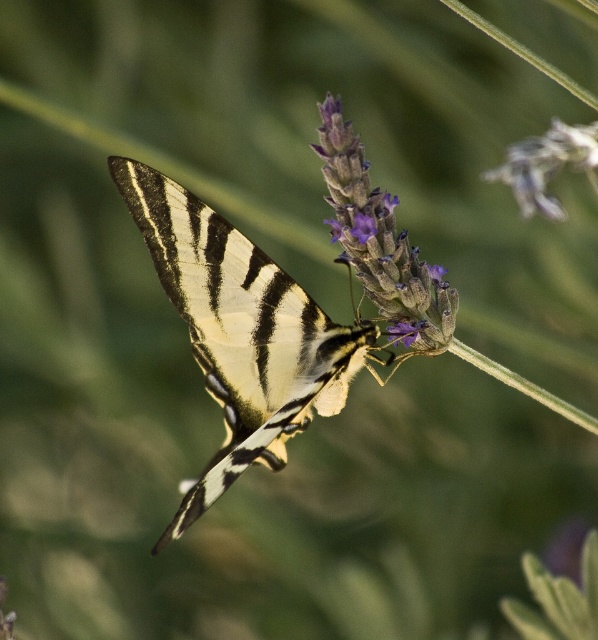
You are an entomologist studying the positioning of insects in natural settings. In the image provided, where is the shiny gold butterfly at center located in terms of its 2D coordinates?

The shiny gold butterfly at center is located at the 2D coordinates of point (x=240, y=332).

You are a photographer trying to capture the shiny gold butterfly at center and the purple fuzzy lavender at center. Which object will appear larger in your photo?

The shiny gold butterfly at center will appear larger in the photo because it is closer to the viewer than the purple fuzzy lavender at center.

You are holding a net to catch the shiny gold butterfly at center. The net can reach up to 1.5 meters. Can you catch it?

The shiny gold butterfly at center is 1.71 meters away from the viewer, which is beyond the net reaching distance of 1.5 meters. Therefore, you cannot catch it.